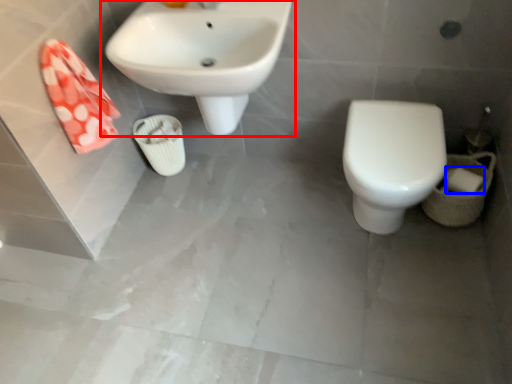
Question: Which object is closer to the camera taking this photo, sink (highlighted by a red box) or toilet paper (highlighted by a blue box)?

Choices:
 (A) sink
 (B) toilet paper

Answer: (A)